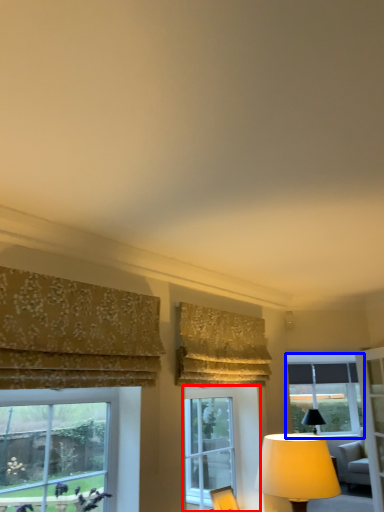
Question: Which object is closer to the camera taking this photo, window (highlighted by a red box) or window (highlighted by a blue box)?

Choices:
 (A) window
 (B) window

Answer: (A)